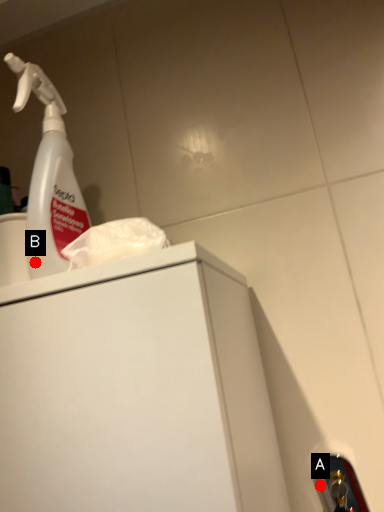
Question: Two points are circled on the image, labeled by A and B beside each circle. Which point is closer to the camera taking this photo?

Choices:
 (A) A is closer
 (B) B is closer

Answer: (B)